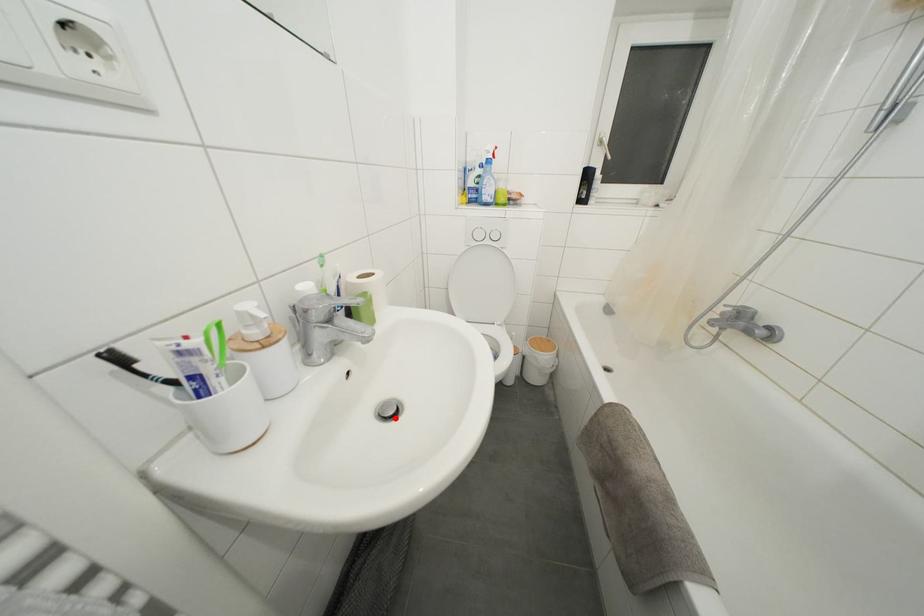
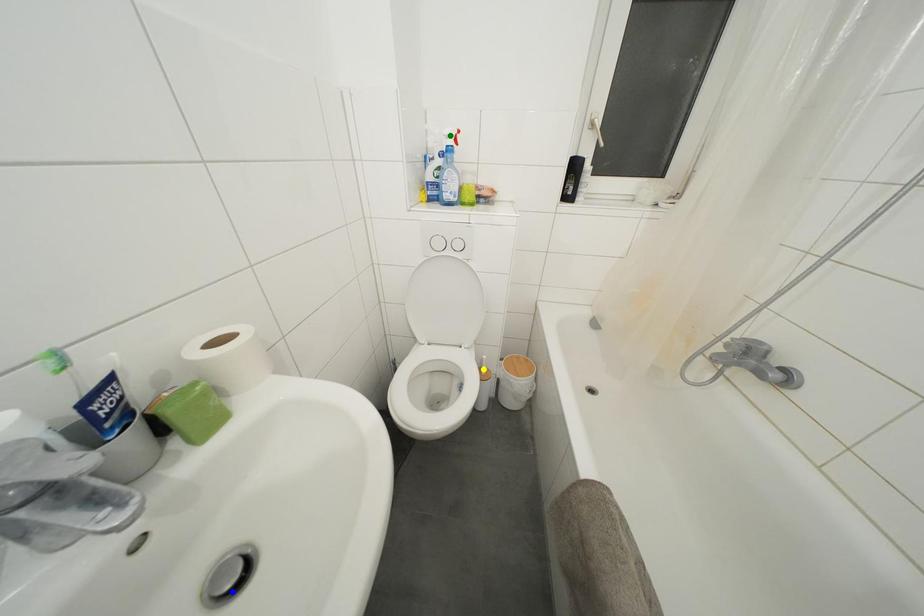
Question: I am providing you with two images of the same scene from different viewpoints. A red point is marked on the first image. You are given multiple points on the second image. Which point in image 2 represents the same 3d spot as the red point in image 1?

Choices:
 (A) blue point
 (B) yellow point
 (C) green point

Answer: (A)